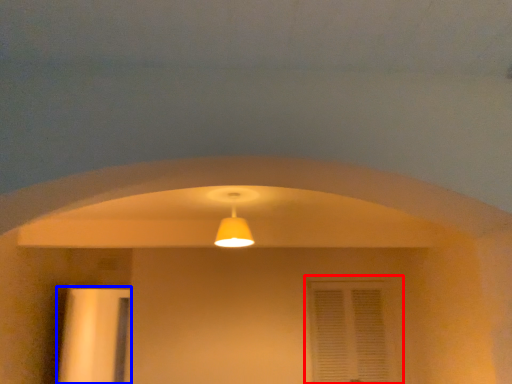
Question: Which object appears closest to the camera in this image, window (highlighted by a red box) or door (highlighted by a blue box)?

Choices:
 (A) window
 (B) door

Answer: (A)